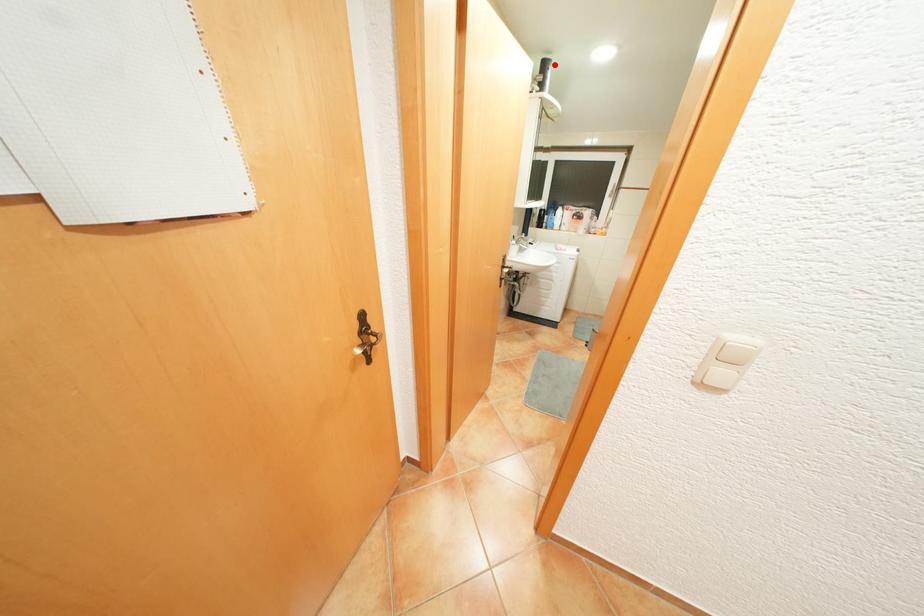
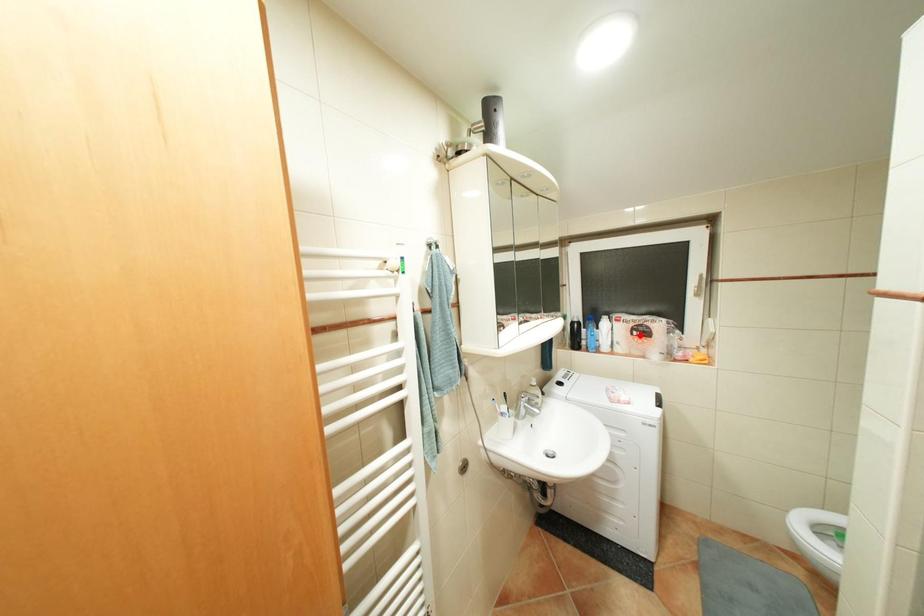
I am providing you with two images of the same scene from different viewpoints. A red point is marked on the first image and another point is marked on the second image. Does the point marked in image1 correspond to the same location as the one in image2?

No